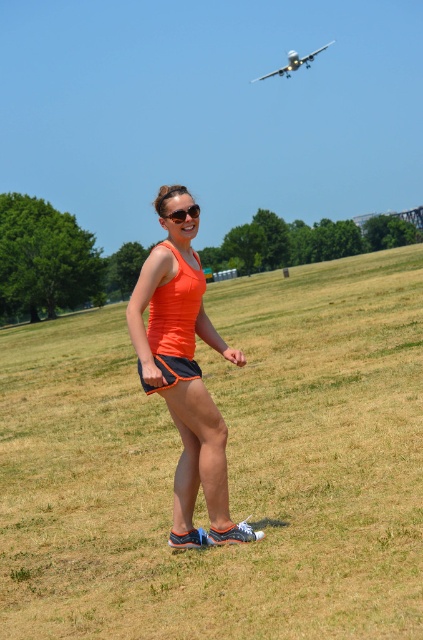
Describe the element at coordinates (170, 371) in the screenshot. This screenshot has width=423, height=640. I see `orange mesh shorts at center` at that location.

Who is taller, orange mesh shorts at center or matte black sunglasses at center?

With more height is orange mesh shorts at center.

Locate an element on the screen. The width and height of the screenshot is (423, 640). orange mesh shorts at center is located at coordinates (170, 371).

The width and height of the screenshot is (423, 640). Find the location of `orange mesh shorts at center`. orange mesh shorts at center is located at coordinates (170, 371).

Does green grass at center appear under matte black sunglasses at center?

Yes.

Does green grass at center appear on the left side of matte black sunglasses at center?

Indeed, green grass at center is positioned on the left side of matte black sunglasses at center.

At what (x,y) coordinates should I click in order to perform the action: click on green grass at center. Please return your answer as a coordinate pair (x, y). The height and width of the screenshot is (640, 423). Looking at the image, I should click on (228, 467).

Locate an element on the screen. green grass at center is located at coordinates (228, 467).

Between green grass at center and orange fabric tank top at center, which one appears on the left side from the viewer's perspective?

green grass at center is more to the left.

Which is above, green grass at center or orange fabric tank top at center?

orange fabric tank top at center

Does point (47, 589) come behind point (186, 205)?

No, it is in front of (186, 205).

Find the location of a particular element. The image size is (423, 640). green grass at center is located at coordinates (228, 467).